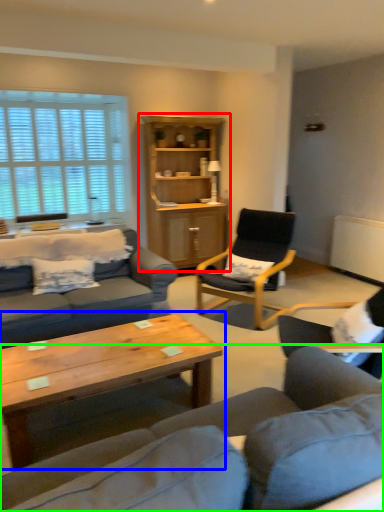
Question: Which object is positioned closest to cabinetry (highlighted by a red box)? Select from coffee table (highlighted by a blue box) and studio couch (highlighted by a green box).

Choices:
 (A) coffee table
 (B) studio couch

Answer: (A)